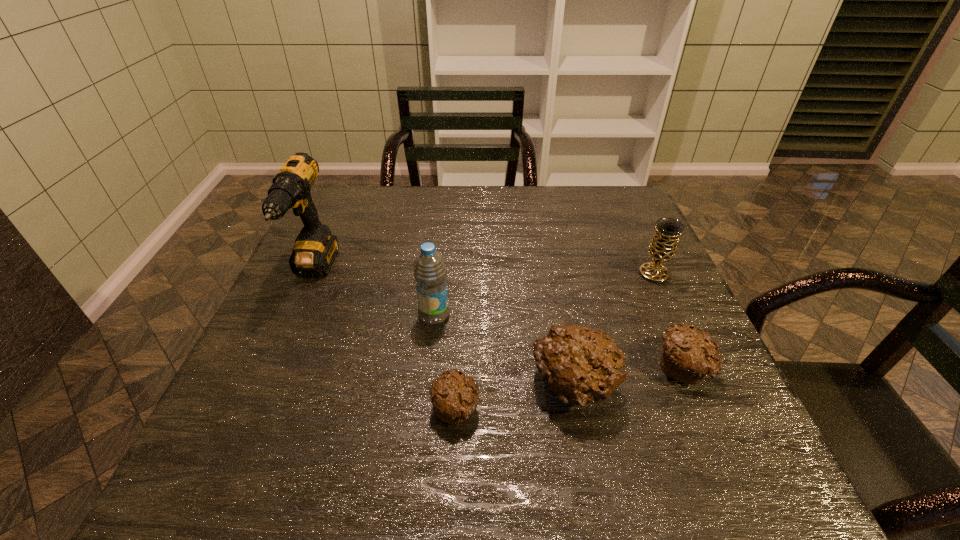
This screenshot has height=540, width=960. I want to click on object that is positioned at the near right corner, so click(688, 355).

You are a GUI agent. You are given a task and a screenshot of the screen. Output one action in this format:
    pyautogui.click(x=<x>, y=<y>)
    Task: Click on the vacant space at the far edge
    The image size is (960, 540).
    Given the screenshot: What is the action you would take?
    pyautogui.click(x=482, y=188)

Image resolution: width=960 pixels, height=540 pixels. I want to click on vacant region at the left edge of the desktop, so click(360, 242).

Identify the location of vacant space at the right edge of the desktop. (659, 360).

At what (x,y) coordinates should I click in order to perform the action: click on vacant space at the far left corner of the desktop. Please return your answer as a coordinate pair (x, y). The image size is (960, 540). Looking at the image, I should click on (359, 191).

The height and width of the screenshot is (540, 960). I want to click on vacant region at the near right corner of the desktop, so coord(747,424).

This screenshot has height=540, width=960. I want to click on free space between the drill and the tallest muffin, so click(444, 329).

Locate an element on the screen. Image resolution: width=960 pixels, height=540 pixels. vacant point located between the chalice and the drill is located at coordinates (484, 273).

Image resolution: width=960 pixels, height=540 pixels. Identify the location of vacant point located between the chalice and the second muffin from left to right. (614, 330).

You are a GUI agent. You are given a task and a screenshot of the screen. Output one action in this format:
    pyautogui.click(x=<x>, y=<y>)
    Task: Click on the empty location between the tallest muffin and the fourth shortest object
    
    Given the screenshot: What is the action you would take?
    pyautogui.click(x=614, y=330)